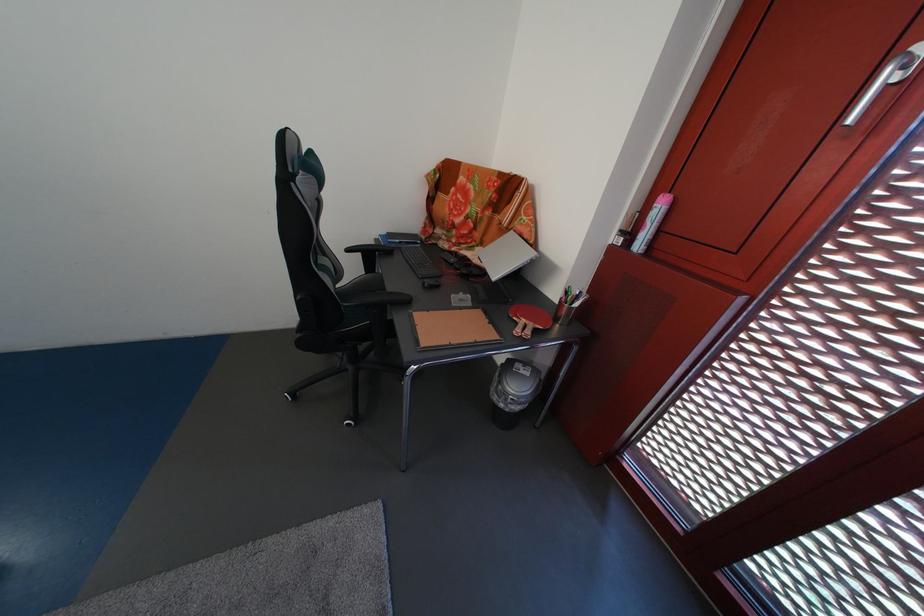
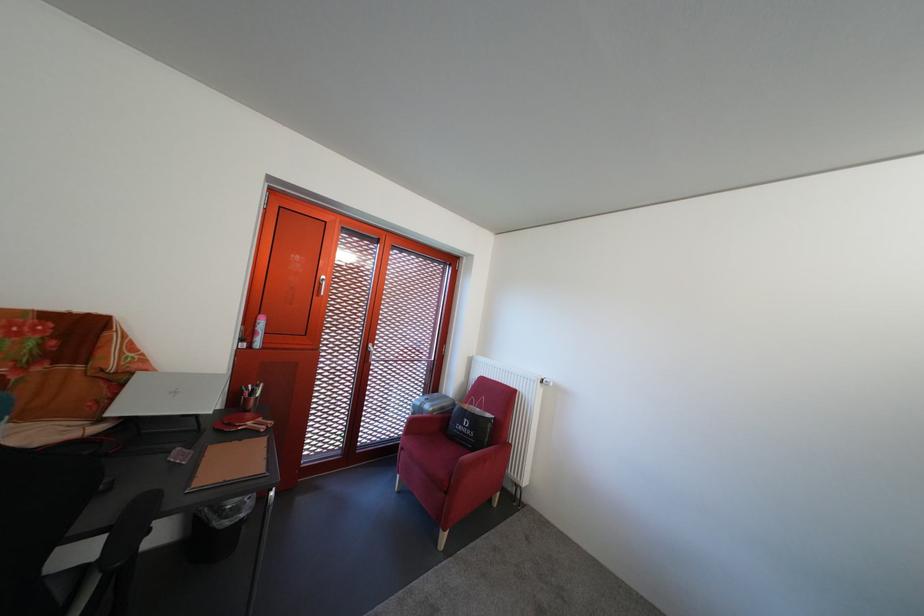
The point at [505,405] is marked in the first image. Where is the corresponding point in the second image?

(237, 530)